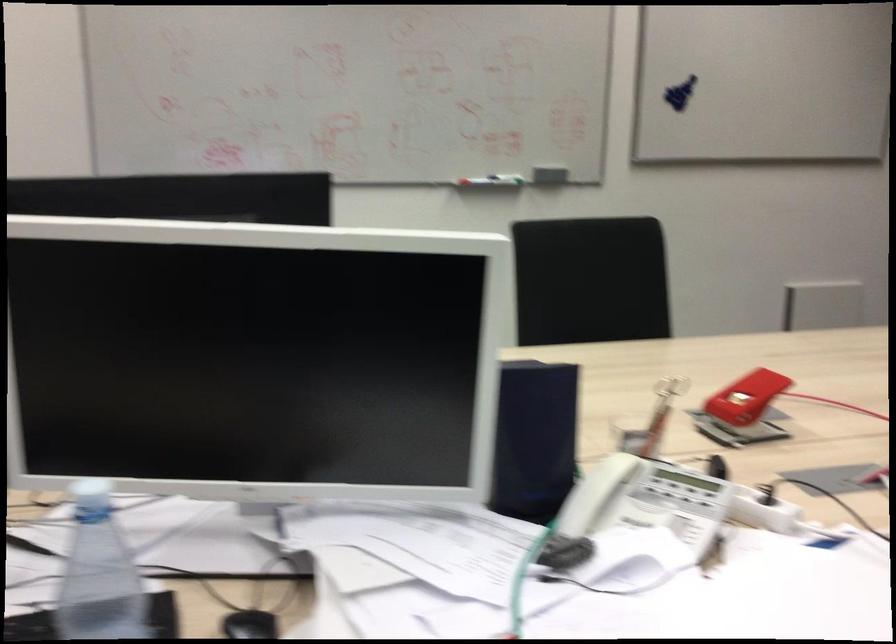
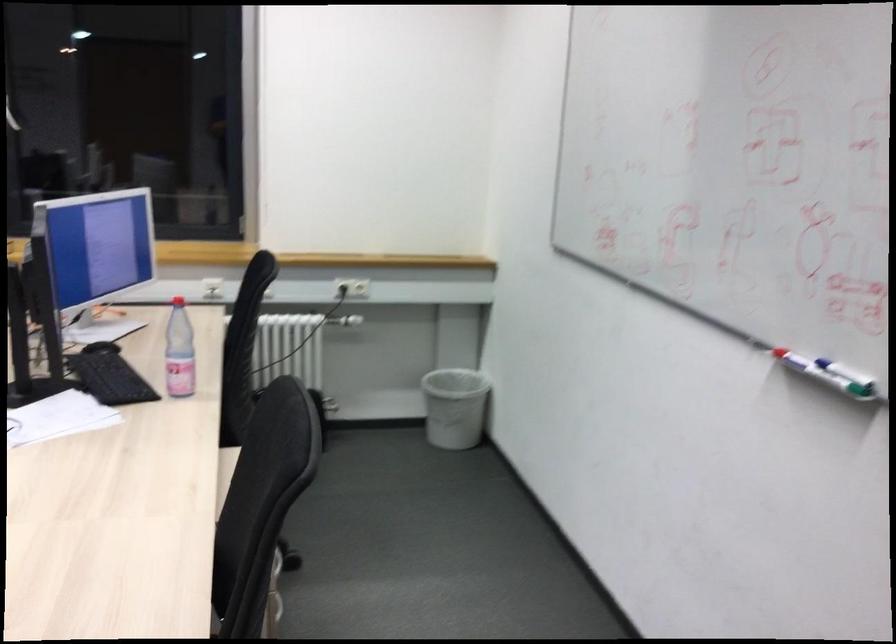
In the second image, find the point that corresponds to point (492, 176) in the first image.

(829, 374)